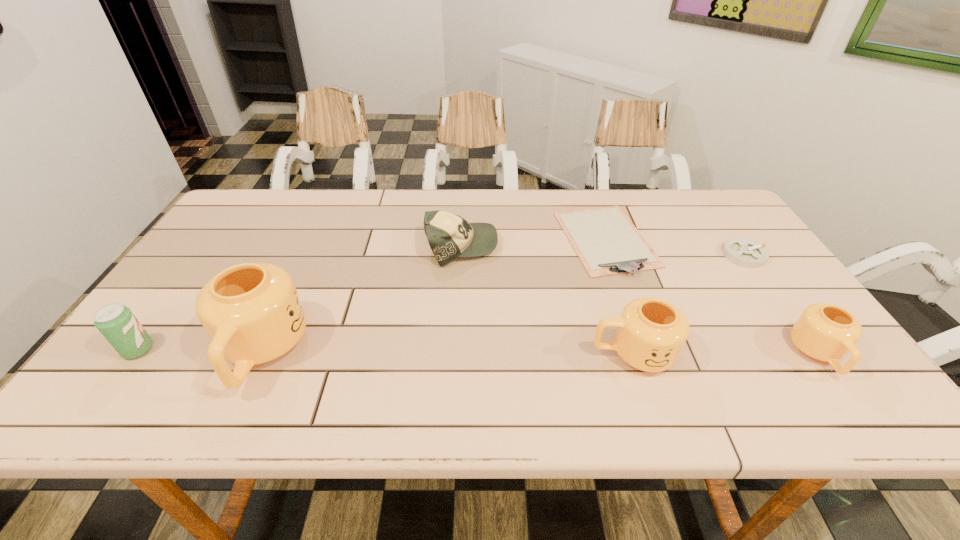
To ensure equal spacing by inserting another mug among them, please point out a vacant spot for this new mug. Please provide its 2D coordinates. Your answer should be formatted as a tuple, i.e. [(x, y)], where the tuple contains the x and y coordinates of a point satisfying the conditions above.

[(446, 353)]